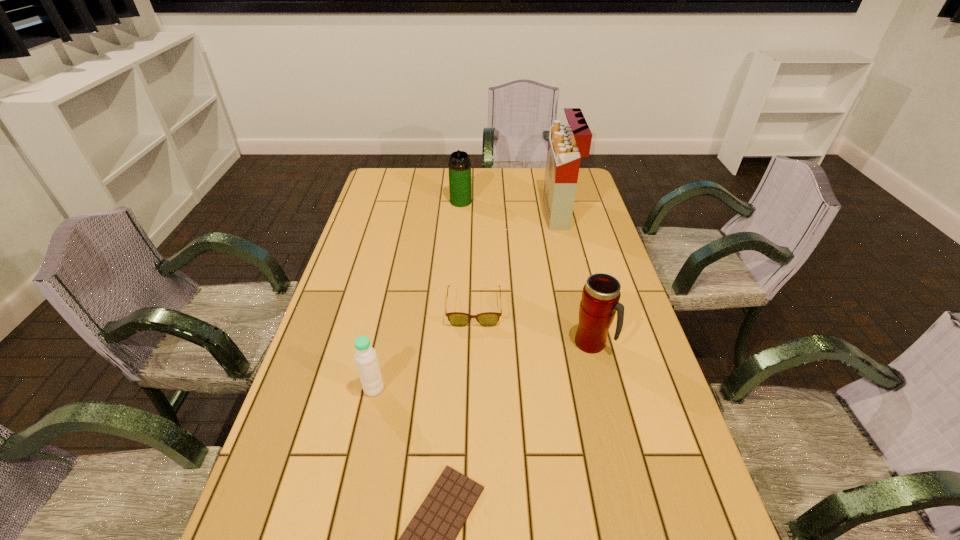
Find the location of a particular element. vacant area at the right edge is located at coordinates (598, 212).

Locate an element on the screen. The height and width of the screenshot is (540, 960). vacant space at the far left corner of the desktop is located at coordinates (397, 195).

This screenshot has width=960, height=540. Identify the location of free area in between the nearer thermos bottle and the farther thermos bottle. (526, 272).

I want to click on free spot between the leftmost object and the fourth farthest object, so 483,366.

This screenshot has height=540, width=960. What are the coordinates of `free point between the fifth tallest object and the left thermos bottle` in the screenshot? It's located at (468, 255).

Identify the location of empty space between the third farthest object and the water bottle. (423, 349).

Find the location of a particular element. Image resolution: width=960 pixels, height=540 pixels. unoccupied position between the farther thermos bottle and the spectacles is located at coordinates (468, 255).

Identify the location of vacant space that is in between the fourth nearest object and the third nearest object. (533, 327).

Choose which object is the fourth nearest neighbor to the left thermos bottle. Please provide its 2D coordinates. Your answer should be formatted as a tuple, i.e. [(x, y)], where the tuple contains the x and y coordinates of a point satisfying the conditions above.

[(365, 356)]

At what (x,y) coordinates should I click in order to perform the action: click on object that is the fifth nearest to the tallest object. Please return your answer as a coordinate pair (x, y). Looking at the image, I should click on (429, 539).